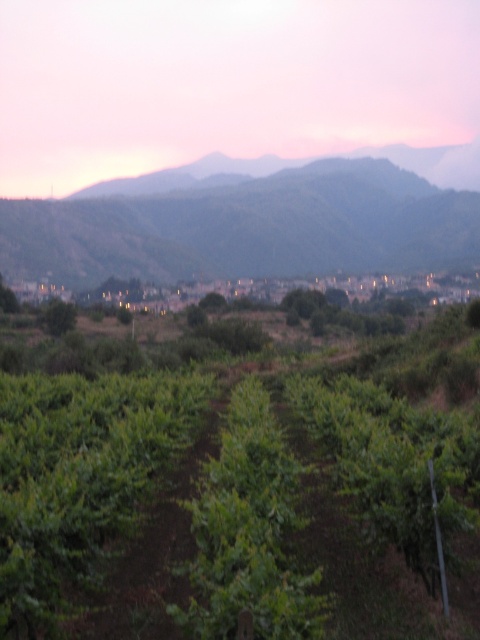
Question: In this image, where is green leafy vineyard at center located relative to green leafy hillside at center?

Choices:
 (A) left
 (B) right

Answer: (B)

Question: Can you confirm if green leafy vineyard at center is wider than green leafy hillside at center?

Choices:
 (A) no
 (B) yes

Answer: (A)

Question: Which point is farther from the camera taking this photo?

Choices:
 (A) (389, 164)
 (B) (430, 445)

Answer: (A)

Question: Which of the following is the farthest from the observer?

Choices:
 (A) green leafy vineyard at center
 (B) green leafy hillside at center

Answer: (B)

Question: In this image, where is green leafy vineyard at center located relative to green leafy hillside at center?

Choices:
 (A) right
 (B) left

Answer: (A)